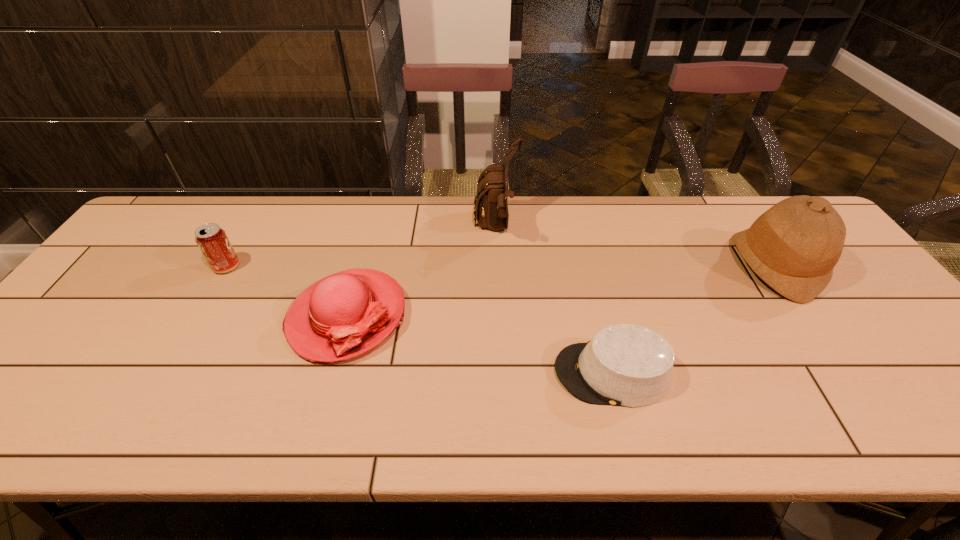
Identify the location of vacant point located between the shoulder bag and the shortest hat. The width and height of the screenshot is (960, 540). (554, 301).

Identify the location of vacant area between the tallest hat and the shoulder bag. The width and height of the screenshot is (960, 540). (636, 247).

Where is `unoccupied position between the rightmost hat and the shortest hat`? This screenshot has height=540, width=960. unoccupied position between the rightmost hat and the shortest hat is located at coordinates (693, 319).

At what (x,y) coordinates should I click in order to perform the action: click on vacant point located between the tallest hat and the fourth object from right to left. Please return your answer as a coordinate pair (x, y). The width and height of the screenshot is (960, 540). Looking at the image, I should click on (561, 291).

Where is `vacant area that lies between the second object from left to right and the third object from left to right`? This screenshot has width=960, height=540. vacant area that lies between the second object from left to right and the third object from left to right is located at coordinates (421, 272).

Where is `vacant point located between the leftmost object and the third object from right to left`? vacant point located between the leftmost object and the third object from right to left is located at coordinates (361, 247).

Locate an element on the screen. The width and height of the screenshot is (960, 540). vacant space that is in between the shortest hat and the third object from right to left is located at coordinates pyautogui.click(x=554, y=301).

You are a GUI agent. You are given a task and a screenshot of the screen. Output one action in this format:
    pyautogui.click(x=<x>, y=<y>)
    Task: Click on the free area in between the shoulder bag and the second object from right to left
    This screenshot has height=540, width=960.
    Given the screenshot: What is the action you would take?
    pyautogui.click(x=554, y=301)

Locate an element on the screen. free space between the tallest hat and the third object from left to right is located at coordinates (636, 247).

You are a GUI agent. You are given a task and a screenshot of the screen. Output one action in this format:
    pyautogui.click(x=<x>, y=<y>)
    Task: Click on the vacant region between the shortest hat and the leftmost object
    This screenshot has height=540, width=960.
    Given the screenshot: What is the action you would take?
    pyautogui.click(x=420, y=320)